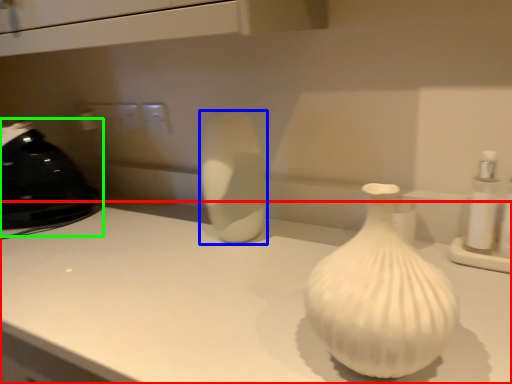
Question: Based on their relative distances, which object is farther from counter top (highlighted by a red box)? Choose from vase (highlighted by a blue box) and appliance (highlighted by a green box).

Choices:
 (A) vase
 (B) appliance

Answer: (B)